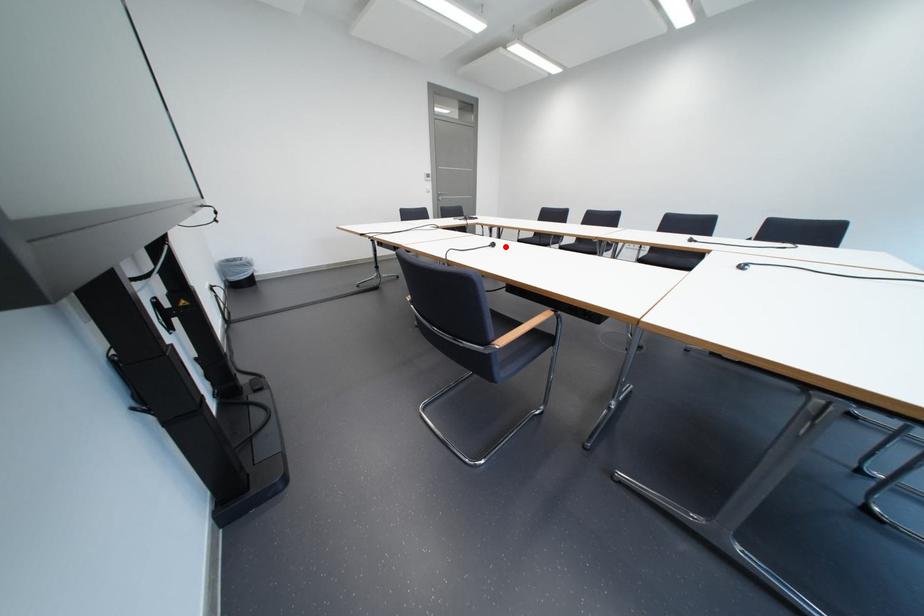
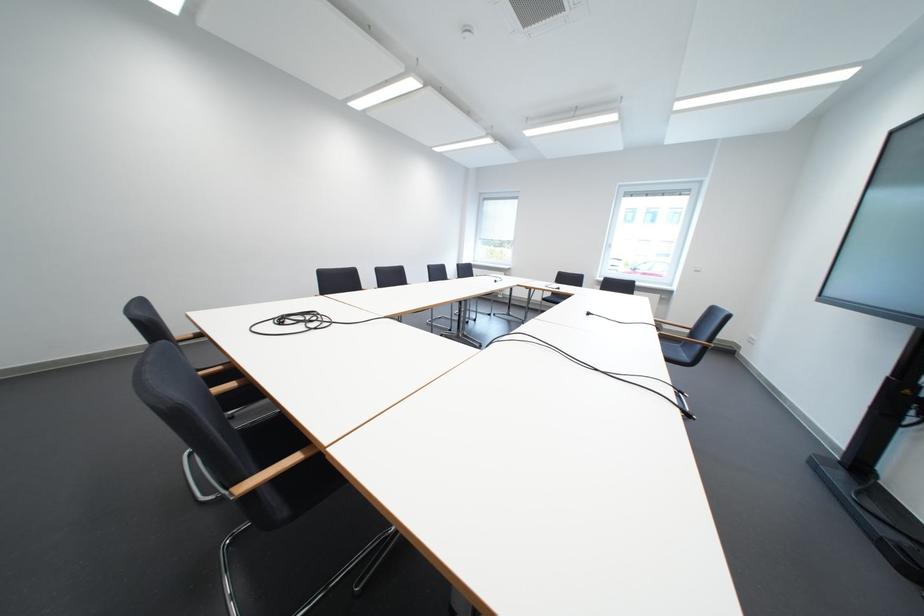
Locate, in the second image, the point that corresponds to the highlighted location in the first image.

(601, 315)